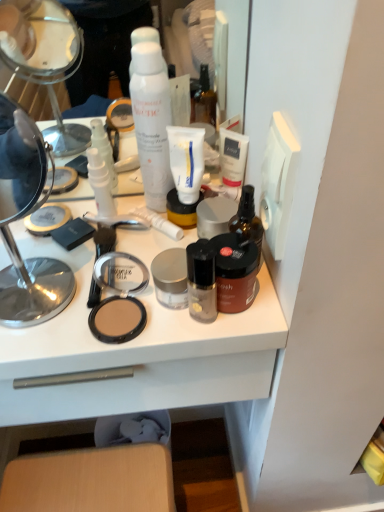
The height and width of the screenshot is (512, 384). I want to click on free space in front of white plastic tube at center, which appears as the second toiletry when viewed from the left, so click(129, 298).